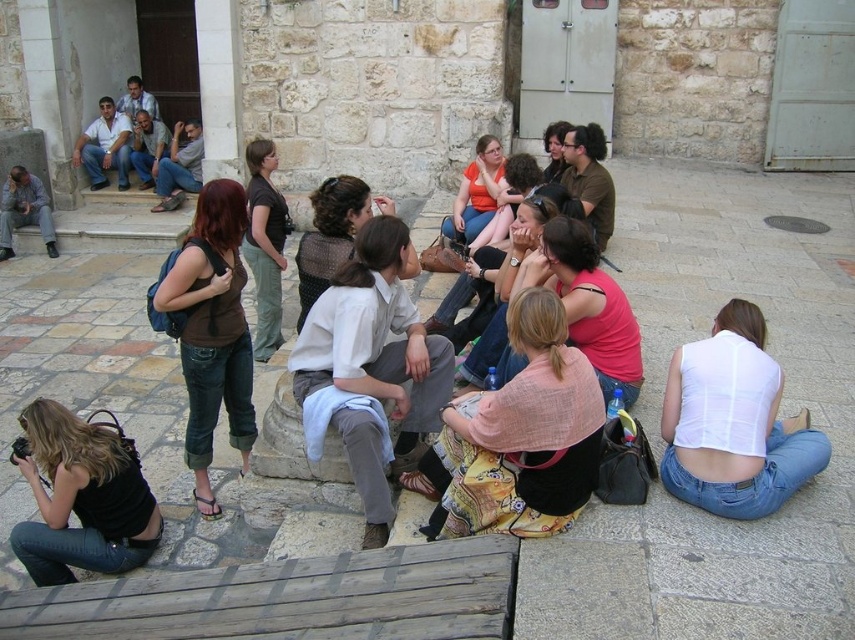
Question: Is black denim jeans at lower left thinner than matte brown shirt at center?

Choices:
 (A) no
 (B) yes

Answer: (A)

Question: Which point appears farthest from the camera in this image?

Choices:
 (A) (490, 192)
 (B) (335, 224)
 (C) (746, 300)
 (D) (262, 168)

Answer: (A)

Question: Can you confirm if matte black shirt at center is positioned above knitted sweater at center?

Choices:
 (A) no
 (B) yes

Answer: (B)

Question: Can you confirm if matte brown shirt at center is positioned below matte orange shirt at center?

Choices:
 (A) no
 (B) yes

Answer: (B)

Question: Which object appears closest to the camera in this image?

Choices:
 (A) light brown fabric shirt at center
 (B) matte black shirt at center

Answer: (A)

Question: Which object is closer to the camera taking this photo?

Choices:
 (A) white sheer top at lower right
 (B) light brown fabric shirt at center

Answer: (A)